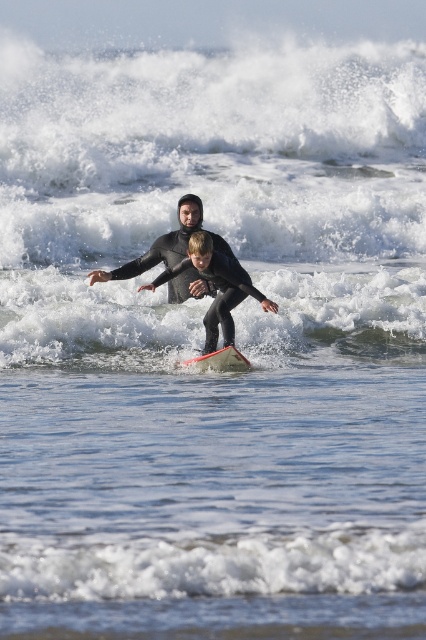
You are a photographer trying to capture the perfect shot of the black matte wetsuit at center and the orange matte surfboard at center. Since you want to emphasize the subject, which object should you focus on to ensure it takes up more space in the photo?

The black matte wetsuit at center is larger in size than the orange matte surfboard at center, so focusing on it will make it take up more space in the photo.

Looking at this image, you are a photographer trying to capture the perfect shot of the black matte wetsuit at center. You know the camera can only focus on objects within a 0.1 unit radius around point (195, 272). Is the black matte wetsuit at center within this focus area?

The black matte wetsuit at center is exactly at point (195, 272), so it is within the camera focus area of 0.1 unit radius around that point.

In the scene shown: You are a drone operator trying to capture the best aerial shot of the black matte wetsuit at center. Given the coordinates provided in the Objects Description, can you confirm if the wetsuit is positioned centrally within the frame?

The black matte wetsuit at center is located at point (195,272), which is close to the center coordinates of an image frame, typically around (213,320). Therefore, the wetsuit is positioned centrally within the frame.